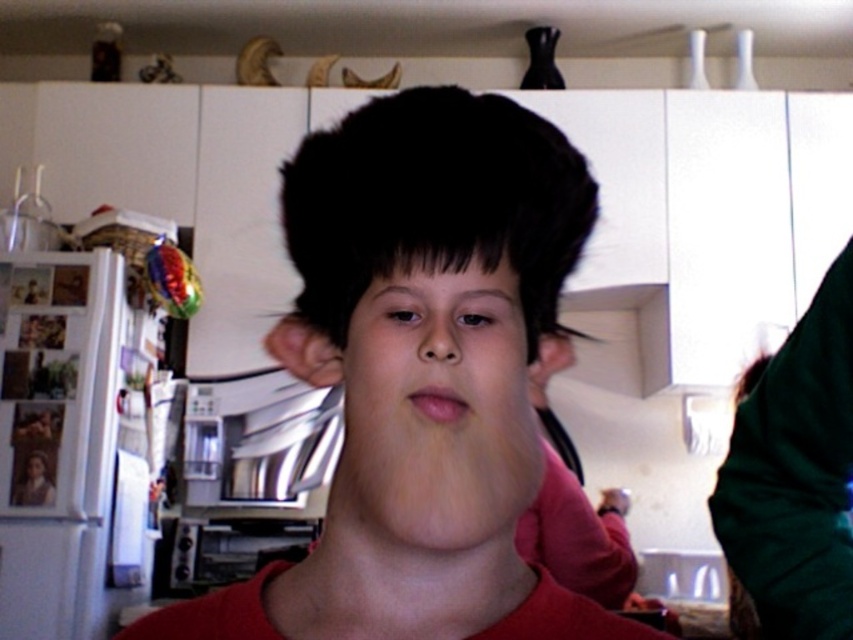
You are standing in the kitchen and want to reach the point at coordinates (456, 324). If your arm can extend 12 inches, can you comfortably reach that point?

The point at coordinates (456, 324) is 11.92 inches away from the viewer, so yes, you can comfortably reach it since your arm can extend 12 inches.

Based on the scene description, if you were to draw a vertical line dividing the image into two equal parts, which object would be closer to the top half? The black matte hair at center or the pink smooth lips at center?

The black matte hair at center is taller than the pink smooth lips at center, so it would be closer to the top half.